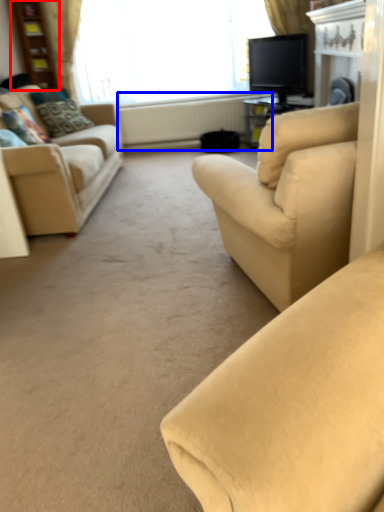
Question: Among these objects, which one is nearest to the camera, bookshelf (highlighted by a red box) or radiator (highlighted by a blue box)?

Choices:
 (A) bookshelf
 (B) radiator

Answer: (A)